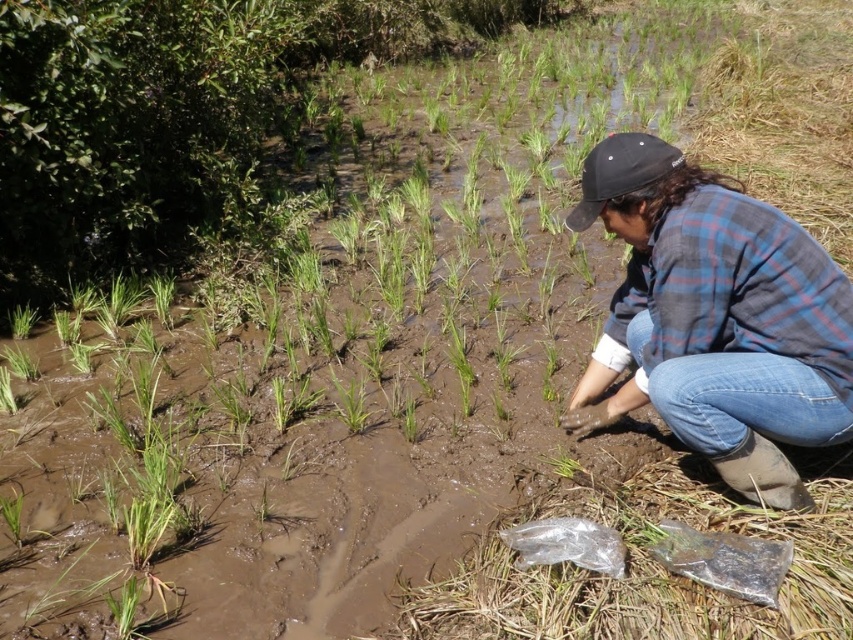
You are standing in the paddy field and see the person planting rice. Where is the blue plaid shirt at center right located relative to the point marked at coordinates (x=715, y=317)?

The point marked at coordinates (x=715, y=317) indicates the location of the blue plaid shirt at center right.

You are a farmer looking at the paddy field. You notice the blue plaid shirt at center right and the green grass at center. Which object is positioned higher in the image?

The blue plaid shirt at center right is located above the green grass at center, so it is positioned higher in the image.